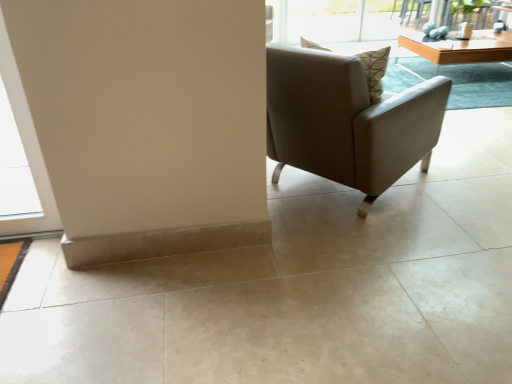
Question: Considering the relative positions of light brown wooden table at upper right and matte gray armchair at center in the image provided, is light brown wooden table at upper right to the left or to the right of matte gray armchair at center?

Choices:
 (A) left
 (B) right

Answer: (B)

Question: In terms of width, does light brown wooden table at upper right look wider or thinner when compared to matte gray armchair at center?

Choices:
 (A) wide
 (B) thin

Answer: (B)

Question: From a real-world perspective, is light brown wooden table at upper right positioned above or below matte gray armchair at center?

Choices:
 (A) below
 (B) above

Answer: (A)

Question: From the image's perspective, is matte gray armchair at center positioned above or below light brown wooden table at upper right?

Choices:
 (A) below
 (B) above

Answer: (A)

Question: Is matte gray armchair at center in front of or behind light brown wooden table at upper right in the image?

Choices:
 (A) behind
 (B) front

Answer: (B)

Question: Is matte gray armchair at center wider or thinner than light brown wooden table at upper right?

Choices:
 (A) wide
 (B) thin

Answer: (A)

Question: Is matte gray armchair at center inside the boundaries of light brown wooden table at upper right, or outside?

Choices:
 (A) outside
 (B) inside

Answer: (A)